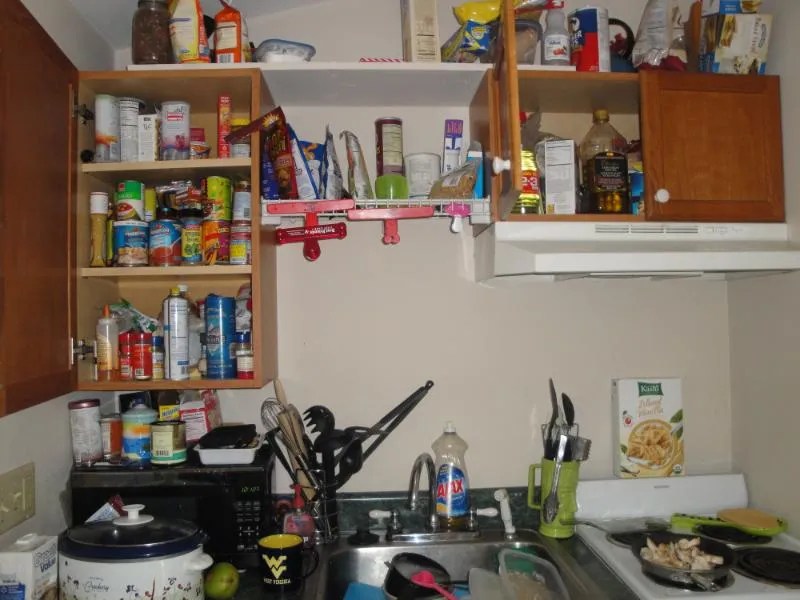
You are a GUI agent. You are given a task and a screenshot of the screen. Output one action in this format:
    pyautogui.click(x=<x>, y=<y>)
    Task: Click on the ceiling
    
    Given the screenshot: What is the action you would take?
    pyautogui.click(x=112, y=12)